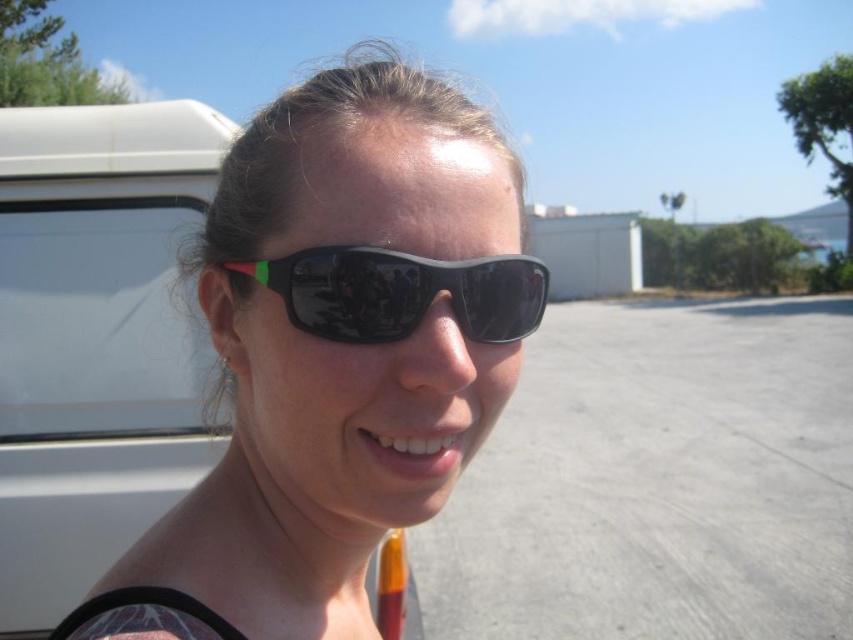
Measure the distance from black plastic sunglasses at center to black rubber sunglasses at center.

A distance of 2.89 inches exists between black plastic sunglasses at center and black rubber sunglasses at center.

Is the position of black plastic sunglasses at center less distant than that of black rubber sunglasses at center?

Yes.

Locate an element on the screen. The height and width of the screenshot is (640, 853). black plastic sunglasses at center is located at coordinates (335, 355).

Where is `black plastic sunglasses at center`? The image size is (853, 640). black plastic sunglasses at center is located at coordinates (335, 355).